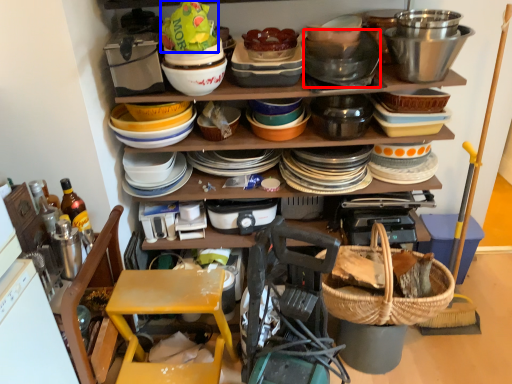
Question: Which of the following is the farthest to the observer, bucket (highlighted by a red box) or food (highlighted by a blue box)?

Choices:
 (A) bucket
 (B) food

Answer: (A)